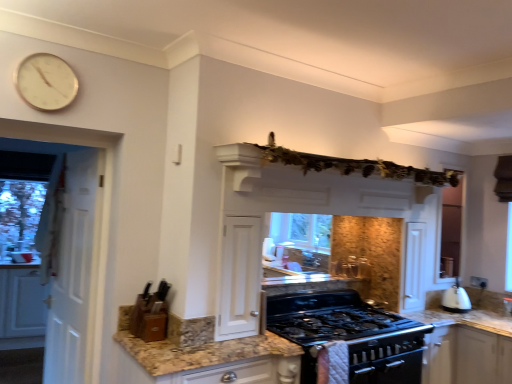
Identify the location of free space in front of wooden knife block at lower left, the first appliance in the top-to-bottom sequence. This screenshot has width=512, height=384. (151, 344).